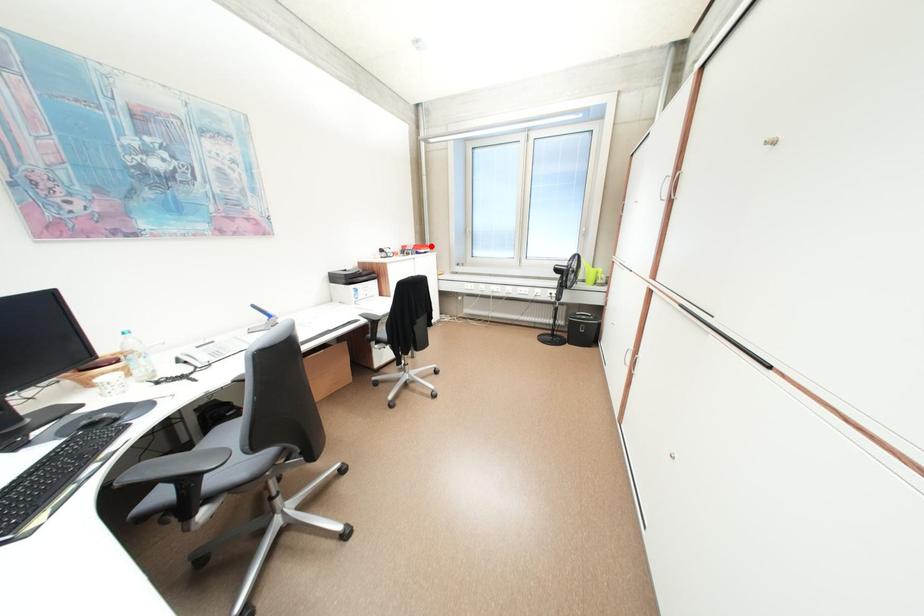
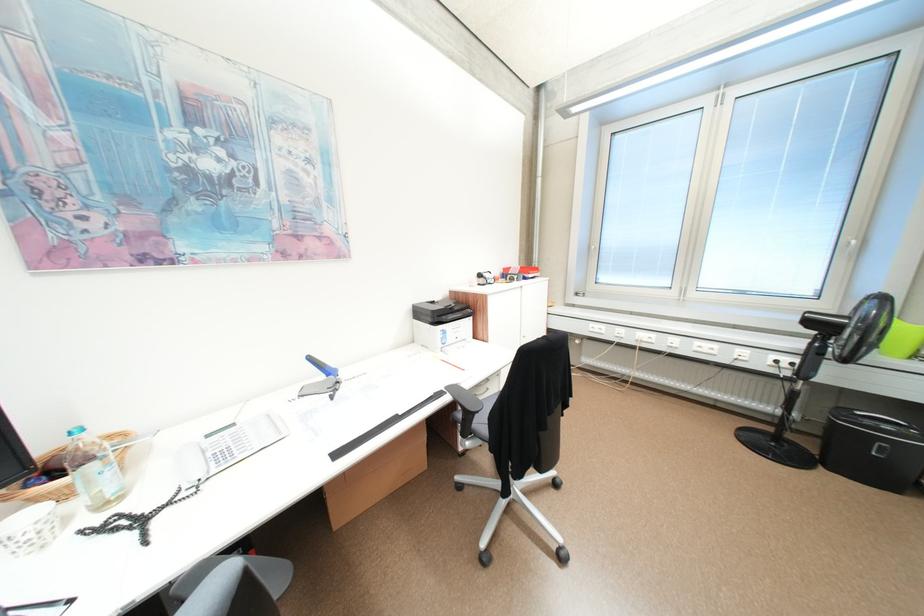
The point at the highlighted location is marked in the first image. Where is the corresponding point in the second image?

(538, 269)